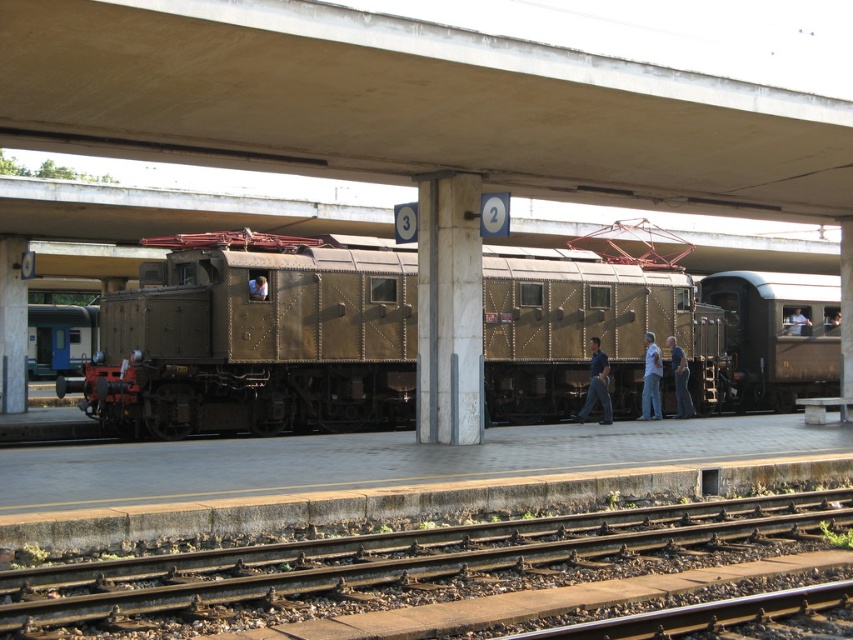
Is smooth metal tracks at lower center bigger than blue shirt at center?

Yes, smooth metal tracks at lower center is bigger than blue shirt at center.

Based on the photo, does smooth metal tracks at lower center appear under blue shirt at center?

Yes, smooth metal tracks at lower center is below blue shirt at center.

This screenshot has width=853, height=640. Describe the element at coordinates (396, 561) in the screenshot. I see `smooth metal tracks at lower center` at that location.

This screenshot has width=853, height=640. I want to click on smooth metal tracks at lower center, so click(x=396, y=561).

Does shiny brown train at right appear under metallic helmet at center?

Yes.

Which is below, shiny brown train at right or metallic helmet at center?

Positioned lower is shiny brown train at right.

Image resolution: width=853 pixels, height=640 pixels. Describe the element at coordinates (776, 336) in the screenshot. I see `shiny brown train at right` at that location.

I want to click on shiny brown train at right, so click(776, 336).

Looking at this image, does smooth metal tracks at lower center appear over light blue jeans at center?

Actually, smooth metal tracks at lower center is below light blue jeans at center.

Is point (20, 595) less distant than point (659, 369)?

Yes, it is in front of point (659, 369).

Which is behind, point (508, 541) or point (640, 417)?

The point (640, 417) is more distant.

In order to click on smooth metal tracks at lower center in this screenshot , I will do `click(396, 561)`.